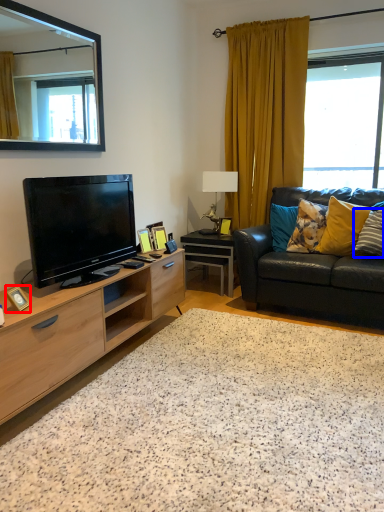
Question: Which of the following is the closest to the observer, picture frame (highlighted by a red box) or pillow (highlighted by a blue box)?

Choices:
 (A) picture frame
 (B) pillow

Answer: (A)